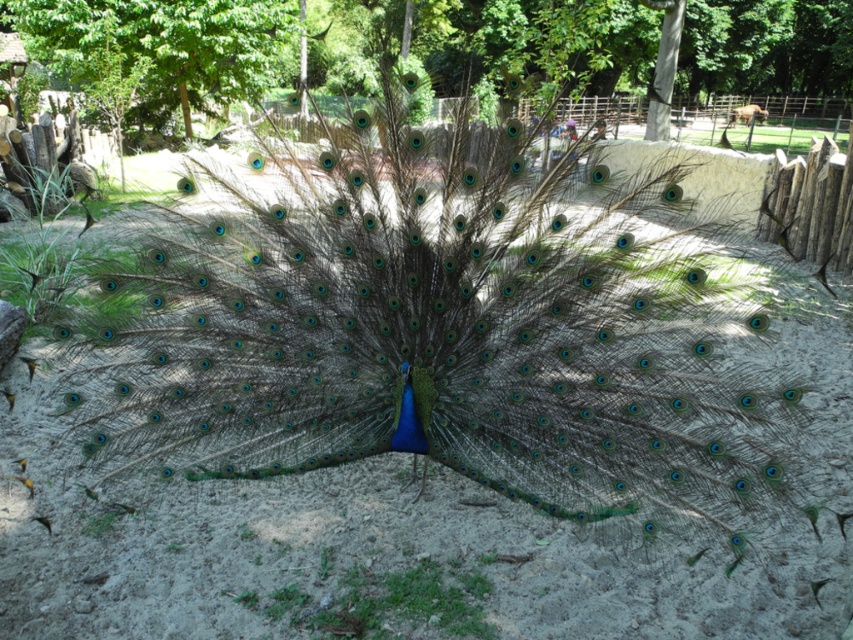
Question: Is green leafy tree at center above green leafy tree at upper center?

Choices:
 (A) yes
 (B) no

Answer: (A)

Question: Is green leafy tree at center above green leafy tree at upper center?

Choices:
 (A) no
 (B) yes

Answer: (B)

Question: Is green leafy tree at center behind green leafy tree at upper center?

Choices:
 (A) no
 (B) yes

Answer: (A)

Question: Which point is closer to the camera taking this photo?

Choices:
 (A) (476, 74)
 (B) (180, 77)

Answer: (B)

Question: Among these points, which one is nearest to the camera?

Choices:
 (A) (55, 60)
 (B) (55, 68)

Answer: (A)